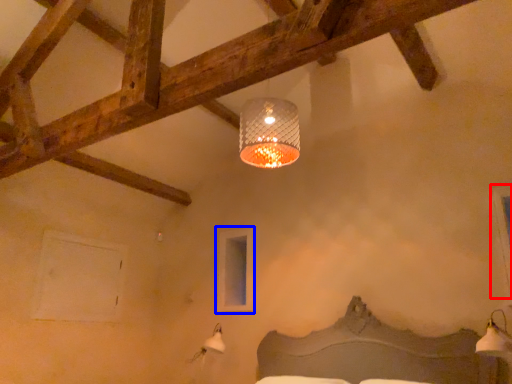
Question: Among these objects, which one is nearest to the camera, window (highlighted by a red box) or window (highlighted by a blue box)?

Choices:
 (A) window
 (B) window

Answer: (A)